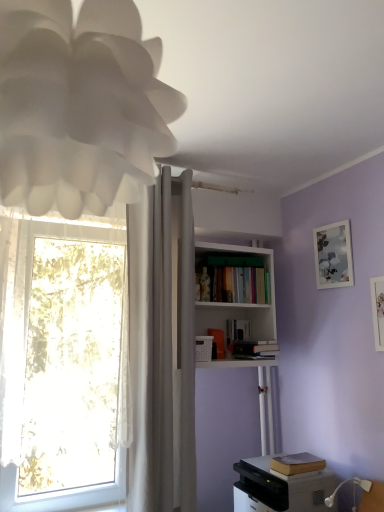
This screenshot has width=384, height=512. Describe the element at coordinates (333, 255) in the screenshot. I see `matte white picture frame at upper right, which is the first picture frame from back to front` at that location.

How much space does brown leather book at lower right, arranged as the fifth book when viewed from the top, occupy horizontally?

brown leather book at lower right, arranged as the fifth book when viewed from the top, is 9.99 inches wide.

How much space does hardcover book at upper center, positioned as the third book in top-to-bottom order, occupy vertically?

It is 6.66 inches.

The height and width of the screenshot is (512, 384). What are the coordinates of `hardcover book at upper center, positioned as the third book in top-to-bottom order` in the screenshot? It's located at (218, 341).

Image resolution: width=384 pixels, height=512 pixels. I want to click on hardcover book at upper center, which appears as the 2th book when viewed from the top, so click(x=238, y=335).

Are brown leather book at lower right, arranged as the fifth book when viewed from the top, and hardcover books at center, the 5th book positioned from the bottom, beside each other?

No, brown leather book at lower right, arranged as the fifth book when viewed from the top, is not next to hardcover books at center, the 5th book positioned from the bottom.

Is the depth of brown leather book at lower right, the first book positioned from the bottom, greater than that of hardcover books at center, the 5th book positioned from the bottom?

No, the depth of brown leather book at lower right, the first book positioned from the bottom, is less than that of hardcover books at center, the 5th book positioned from the bottom.

From the picture: Would you say brown leather book at lower right, the first book positioned from the bottom, is inside or outside hardcover books at center, which is the 1th book in top-to-bottom order?

The correct answer is: outside.

Does brown leather book at lower right, arranged as the fifth book when viewed from the top, have a lesser height compared to hardcover books at center, the 5th book positioned from the bottom?

Correct, brown leather book at lower right, arranged as the fifth book when viewed from the top, is not as tall as hardcover books at center, the 5th book positioned from the bottom.

Which object is further away from the camera, white plastic remote control at upper center or hardcover books at center, the 5th book positioned from the bottom?

hardcover books at center, the 5th book positioned from the bottom, is more distant.

From a real-world perspective, which is physically above, white plastic remote control at upper center or hardcover books at center, the 5th book positioned from the bottom?

hardcover books at center, the 5th book positioned from the bottom, from a real-world perspective.

Could you measure the distance between white plastic remote control at upper center and hardcover books at center, the 5th book positioned from the bottom?

13.78 inches.

Is white plastic remote control at upper center facing towards hardcover books at center, the 5th book positioned from the bottom?

No.

In the image, is hardcover books at center, the 5th book positioned from the bottom, positioned in front of or behind hardcover book at upper center, which appears as the fourth book when viewed from the top?

Visually, hardcover books at center, the 5th book positioned from the bottom, is located behind hardcover book at upper center, which appears as the fourth book when viewed from the top.

What's the angular difference between hardcover books at center, which is the 1th book in top-to-bottom order, and hardcover book at upper center, which is counted as the 2th book, starting from the bottom,'s facing directions?

The angle between the facing direction of hardcover books at center, which is the 1th book in top-to-bottom order, and the facing direction of hardcover book at upper center, which is counted as the 2th book, starting from the bottom, is 3.65 degrees.

Is hardcover books at center, which is the 1th book in top-to-bottom order, smaller than hardcover book at upper center, which is counted as the 2th book, starting from the bottom?

Actually, hardcover books at center, which is the 1th book in top-to-bottom order, might be larger than hardcover book at upper center, which is counted as the 2th book, starting from the bottom.

From a real-world perspective, is hardcover books at center, which is the 1th book in top-to-bottom order, positioned over hardcover book at upper center, which is counted as the 2th book, starting from the bottom, based on gravity?

Yes, from a real-world perspective, hardcover books at center, which is the 1th book in top-to-bottom order, is over hardcover book at upper center, which is counted as the 2th book, starting from the bottom

From the image's perspective, is gray matte printer at lower right on top of matte white picture frame at upper right, marked as the 2th picture frame in a right-to-left arrangement?

No.

Is gray matte printer at lower right turned away from matte white picture frame at upper right, marked as the 2th picture frame in a right-to-left arrangement?

That's not correct — gray matte printer at lower right is not looking away from matte white picture frame at upper right, marked as the 2th picture frame in a right-to-left arrangement.

Can you confirm if gray matte printer at lower right is shorter than matte white picture frame at upper right, which is counted as the second picture frame, starting from the front?

Correct, gray matte printer at lower right is not as tall as matte white picture frame at upper right, which is counted as the second picture frame, starting from the front.

From the white paper lampshade at upper left, count 4th books backward and point to it. Please provide its 2D coordinates.

[(218, 341)]

What's the angular difference between hardcover book at upper center, which ranks as the 3th book in bottom-to-top order, and white paper lampshade at upper left's facing directions?

0.00133 degrees.

From a real-world perspective, relative to white paper lampshade at upper left, is hardcover book at upper center, which ranks as the 3th book in bottom-to-top order, vertically above or below?

In terms of real-world spatial position, hardcover book at upper center, which ranks as the 3th book in bottom-to-top order, is below white paper lampshade at upper left.

Is hardcover book at upper center, positioned as the third book in top-to-bottom order, not within white paper lampshade at upper left?

Yes, hardcover book at upper center, positioned as the third book in top-to-bottom order, is not within white paper lampshade at upper left.

Is hardcover book at upper center, which is counted as the 2th book, starting from the bottom, spatially inside gray matte printer at lower right, or outside of it?

hardcover book at upper center, which is counted as the 2th book, starting from the bottom, lies outside gray matte printer at lower right.

Considering the points (241, 356) and (280, 483), which point is in front, point (241, 356) or point (280, 483)?

The point (280, 483) is more forward.

Considering the sizes of objects hardcover book at upper center, which appears as the fourth book when viewed from the top, and gray matte printer at lower right in the image provided, who is taller, hardcover book at upper center, which appears as the fourth book when viewed from the top, or gray matte printer at lower right?

gray matte printer at lower right is taller.

Is hardcover book at upper center, which is counted as the 2th book, starting from the bottom, in front of or behind gray matte printer at lower right in the image?

hardcover book at upper center, which is counted as the 2th book, starting from the bottom, is positioned farther from the viewer than gray matte printer at lower right.

Can you tell me how much brown leather book at lower right, the first book positioned from the bottom, and matte white picture frame at upper right, which is the first picture frame from back to front, differ in facing direction?

brown leather book at lower right, the first book positioned from the bottom, and matte white picture frame at upper right, which is the first picture frame from back to front, are facing 0.253 degrees away from each other.

Based on their positions, is brown leather book at lower right, arranged as the fifth book when viewed from the top, located to the left or right of matte white picture frame at upper right, acting as the first picture frame starting from the left?

In the image, brown leather book at lower right, arranged as the fifth book when viewed from the top, appears on the left side of matte white picture frame at upper right, acting as the first picture frame starting from the left.

Choose the correct answer: Is brown leather book at lower right, arranged as the fifth book when viewed from the top, inside matte white picture frame at upper right, which is counted as the second picture frame, starting from the front, or outside it?

brown leather book at lower right, arranged as the fifth book when viewed from the top, exists outside the volume of matte white picture frame at upper right, which is counted as the second picture frame, starting from the front.

Where is `book in front of the matte white picture frame at upper right, which is the first picture frame from back to front`? This screenshot has height=512, width=384. book in front of the matte white picture frame at upper right, which is the first picture frame from back to front is located at coordinates (297, 463).

Locate an element on the screen. This screenshot has height=512, width=384. the 3rd book to the left of the brown leather book at lower right, the first book positioned from the bottom, starting your count from the anchor is located at coordinates [236, 280].

From the white plastic remote control at upper center, count 2nd book to the right and point to it. Please provide its 2D coordinates.

[(236, 280)]

Estimate the real-world distances between objects in this image. Which object is closer to hardcover book at upper center, which appears as the 2th book when viewed from the top, white fabric curtain at center or brown leather book at lower right, the first book positioned from the bottom?

brown leather book at lower right, the first book positioned from the bottom.

Estimate the real-world distances between objects in this image. Which object is further from hardcover book at upper center, which appears as the 2th book when viewed from the top, white matte bookcase at upper center or gray matte printer at lower right?

gray matte printer at lower right is positioned further to the anchor hardcover book at upper center, which appears as the 2th book when viewed from the top.

Which object lies further to the anchor point white paper lampshade at upper left, matte white picture frame at upper right, the 1th picture frame viewed from the right, or gray matte printer at lower right?

gray matte printer at lower right is positioned further to the anchor white paper lampshade at upper left.

Which object lies further to the anchor point white matte bookcase at upper center, gray matte printer at lower right or white paper lampshade at upper left?

Based on the image, white paper lampshade at upper left appears to be further to white matte bookcase at upper center.

Based on their spatial positions, is gray matte printer at lower right or matte white picture frame at upper right, the second picture frame when ordered from back to front, closer to white sheer curtain at left?

gray matte printer at lower right lies closer to white sheer curtain at left than the other object.

Looking at the image, which one is located closer to hardcover books at center, the 5th book positioned from the bottom, white matte bookcase at upper center or matte white picture frame at upper right, the 1th picture frame viewed from the right?

white matte bookcase at upper center.

Estimate the real-world distances between objects in this image. Which object is closer to white matte bookcase at upper center, matte white picture frame at upper right, which appears as the second picture frame when viewed from the left, or hardcover books at center, the 5th book positioned from the bottom?

Based on the image, hardcover books at center, the 5th book positioned from the bottom, appears to be nearer to white matte bookcase at upper center.

Considering their positions, is hardcover book at upper center, which appears as the 2th book when viewed from the top, positioned further to white paper lampshade at upper left than white fabric curtain at center?

hardcover book at upper center, which appears as the 2th book when viewed from the top, is further to white paper lampshade at upper left.

Where is `curtain situated between white sheer curtain at left and matte white picture frame at upper right, which is the first picture frame from back to front, from left to right`? Image resolution: width=384 pixels, height=512 pixels. curtain situated between white sheer curtain at left and matte white picture frame at upper right, which is the first picture frame from back to front, from left to right is located at coordinates (151, 348).

Locate an element on the screen. This screenshot has width=384, height=512. curtain between white sheer curtain at left and hardcover book at upper center, positioned as the third book in top-to-bottom order, along the z-axis is located at coordinates (151, 348).

Identify the location of curtain between matte white picture frame at upper right, which is counted as the second picture frame, starting from the front, and brown leather book at lower right, the first book positioned from the bottom, in the vertical direction. Image resolution: width=384 pixels, height=512 pixels. (151, 348).

In order to click on picture frame between white paper lampshade at upper left and brown leather book at lower right, arranged as the fifth book when viewed from the top, along the z-axis in this screenshot , I will do `click(378, 310)`.